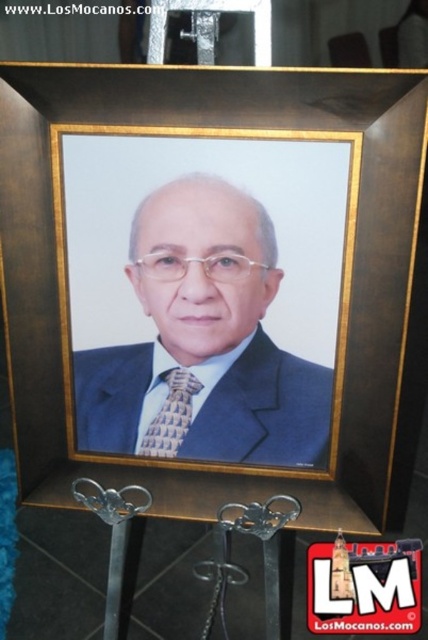
Looking at this image, you are an art curator examining the framed portrait. You need to determine the spatial relationship between the brown wooden picture frame at center and the gold textured tie at center. Which object is positioned higher in the image?

The brown wooden picture frame at center is located above the gold textured tie at center, so it is positioned higher.

Based on the photo, you are an art curator arranging an exhibition. You have a brown wooden picture frame at center and a matte black suit at center. Which object is located to the right of the other?

The brown wooden picture frame at center is positioned on the right side of matte black suit at center.

You are an art curator assessing the dimensions of the portrait. The brown wooden picture frame at center and the gold textured tie at center are both in the image. Which object is taller?

The brown wooden picture frame at center is much taller than the gold textured tie at center.